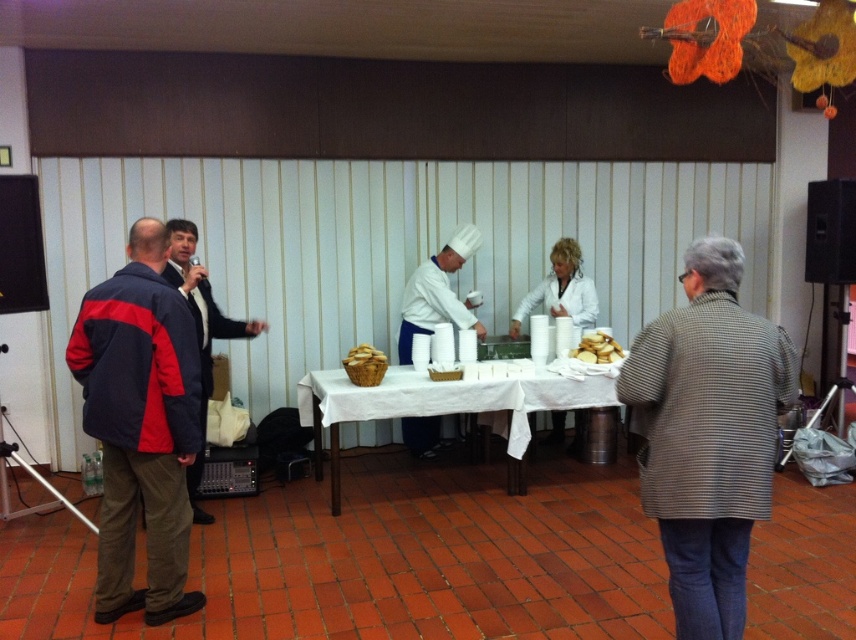
You are a guest at the event and want to grab a bread roll from the golden brown wicker basket at center. However, you notice the matte black jacket at left is in your way. Based on their positions, can you reach the basket without moving the jacket?

The matte black jacket at left is located below the golden brown wicker basket at center, so the jacket is positioned lower than the basket. Since the jacket is below the basket, you can reach the basket without needing to move the jacket as it is not blocking the path from above.

You are organizing a small event and need to place a decorative item on the table. The golden brown wicker basket at center is currently in the way. Can you move it to the left side of the table without overlapping the matte black jacket at left?

The matte black jacket at left might be wider than the golden brown wicker basket at center, so moving the basket to the left side of the table could cause an overlap if there isn